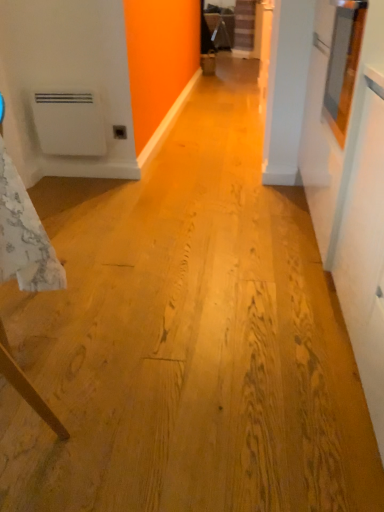
Question: Based on their positions, is white matte water heater at left located to the left or right of white textured tablecloth at left?

Choices:
 (A) right
 (B) left

Answer: (B)

Question: In the image, is white matte water heater at left positioned in front of or behind white textured tablecloth at left?

Choices:
 (A) behind
 (B) front

Answer: (A)

Question: Which object is the closest to the white matte water heater at left?

Choices:
 (A) matte plastic outlet at center
 (B) white textured tablecloth at left

Answer: (A)

Question: Which object is the closest to the matte plastic outlet at center?

Choices:
 (A) white matte water heater at left
 (B) white textured tablecloth at left

Answer: (A)